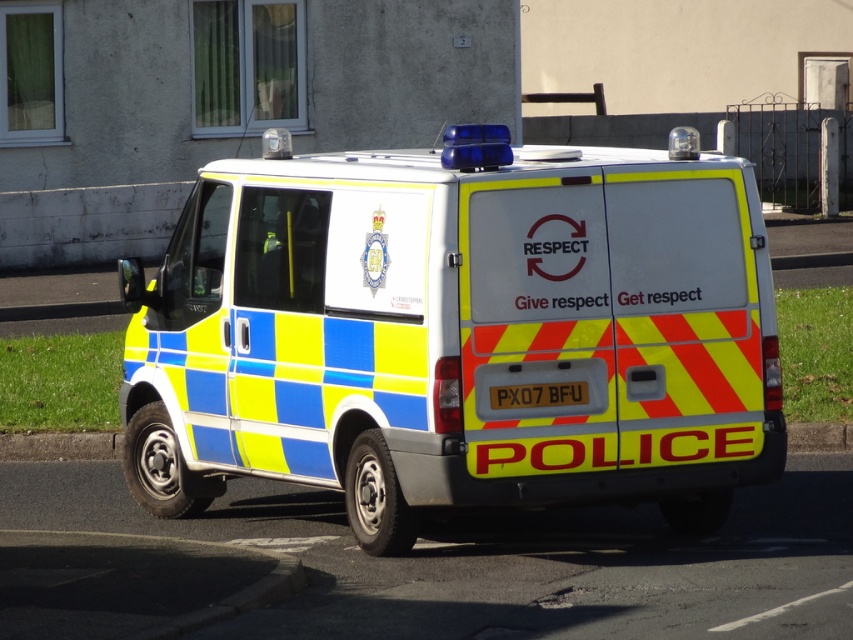
Question: Is the position of yellow and blue checkered police van at center less distant than that of yellow reflective plate at center?

Choices:
 (A) no
 (B) yes

Answer: (B)

Question: In this image, where is yellow and blue checkered police van at center located relative to yellow reflective plate at center?

Choices:
 (A) right
 (B) left

Answer: (B)

Question: Which of the following is the farthest from the observer?

Choices:
 (A) yellow and blue checkered police van at center
 (B) yellow reflective plate at center

Answer: (B)

Question: Which object is closer to the camera taking this photo?

Choices:
 (A) yellow and blue checkered police van at center
 (B) yellow reflective plate at center

Answer: (A)

Question: Is yellow and blue checkered police van at center to the left of yellow reflective plate at center from the viewer's perspective?

Choices:
 (A) yes
 (B) no

Answer: (A)